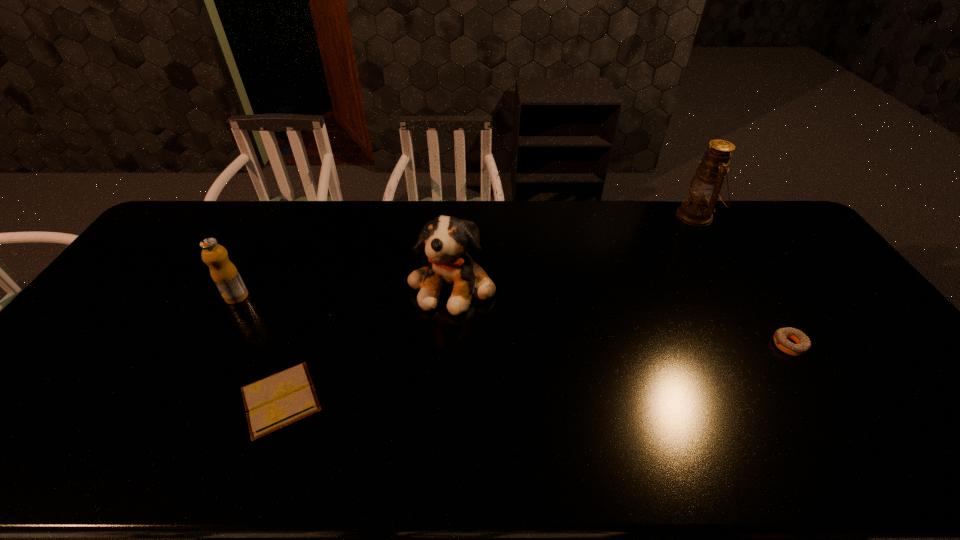
Where is `the farthest object`? The width and height of the screenshot is (960, 540). the farthest object is located at coordinates (704, 189).

Find the location of `the tallest object`. the tallest object is located at coordinates (704, 189).

Where is `puppy`? Image resolution: width=960 pixels, height=540 pixels. puppy is located at coordinates (445, 239).

Find the location of a particular element. the leftmost object is located at coordinates (x=225, y=275).

Where is `the fourth farthest object`? This screenshot has height=540, width=960. the fourth farthest object is located at coordinates (803, 344).

Find the location of a particular element. the fourth tallest object is located at coordinates (803, 344).

The height and width of the screenshot is (540, 960). I want to click on diary, so click(277, 401).

Image resolution: width=960 pixels, height=540 pixels. I want to click on the nearest object, so click(277, 401).

This screenshot has width=960, height=540. I want to click on vacant space located on the front of the oil lamp, so click(714, 247).

At what (x,y) coordinates should I click in order to perform the action: click on vacant space situated at the face of the third object from left to right. Please return your answer as a coordinate pair (x, y). This screenshot has height=540, width=960. Looking at the image, I should click on (447, 369).